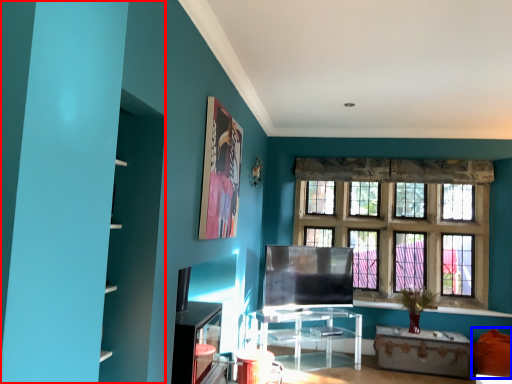
Question: Among these objects, which one is farthest to the camera, bookshelf (highlighted by a red box) or couch (highlighted by a blue box)?

Choices:
 (A) bookshelf
 (B) couch

Answer: (B)